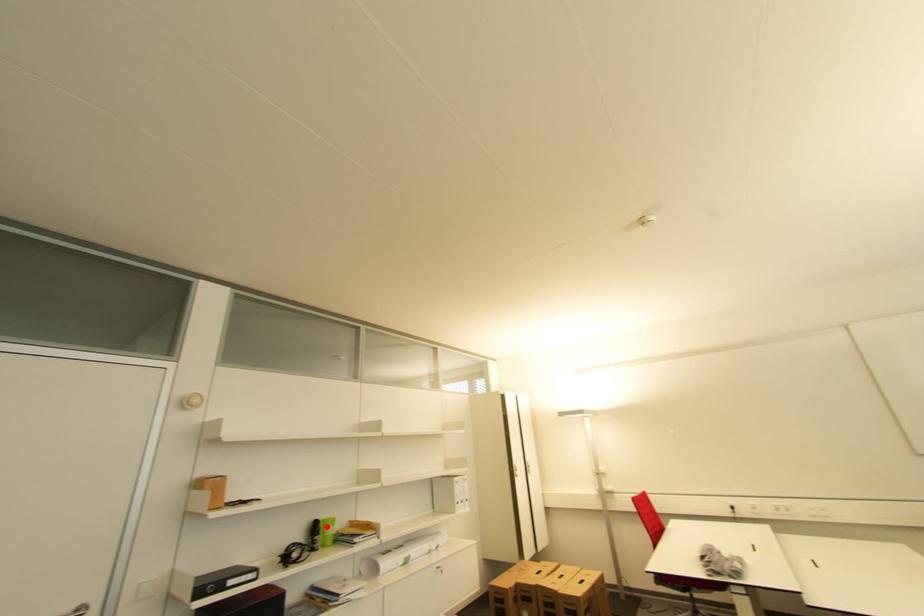
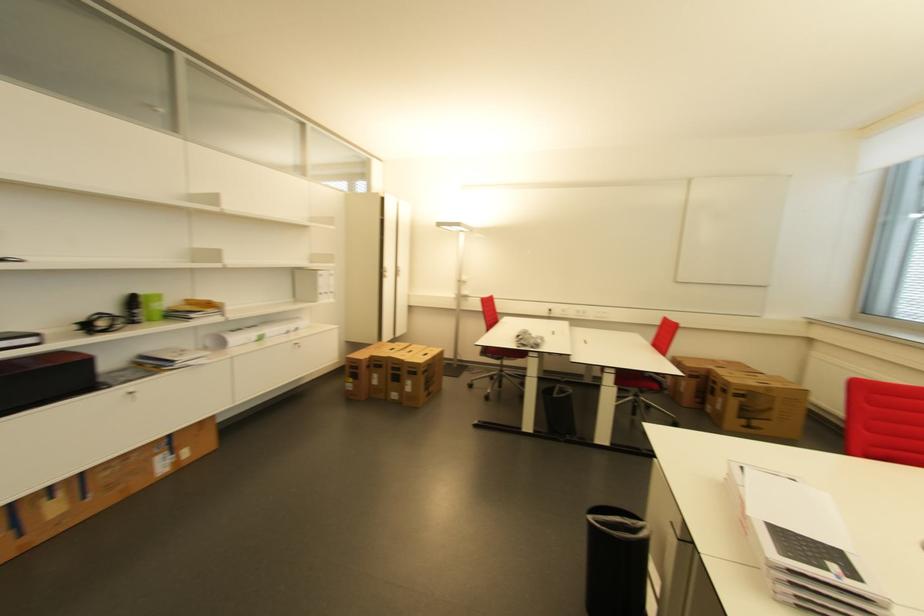
Question: I am providing you with two images of the same scene from different viewpoints. A red point is marked on the first image. At the location where the point appears in image 1, is it still visible in image 2?

Choices:
 (A) Yes
 (B) No

Answer: (A)